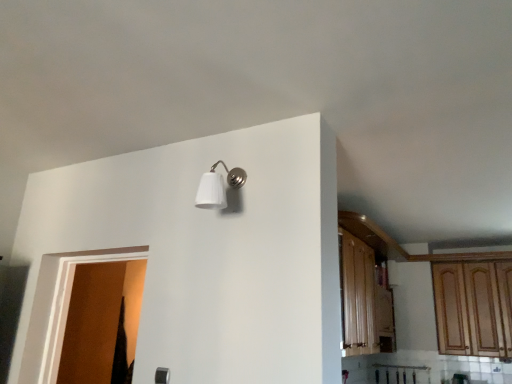
Question: From the image's perspective, is brown matte door at left below wooden cabinet at right?

Choices:
 (A) no
 (B) yes

Answer: (A)

Question: Is brown matte door at left positioned beyond the bounds of wooden cabinet at right?

Choices:
 (A) no
 (B) yes

Answer: (B)

Question: Considering the relative sizes of brown matte door at left and wooden cabinet at right in the image provided, is brown matte door at left thinner than wooden cabinet at right?

Choices:
 (A) yes
 (B) no

Answer: (B)

Question: From the image's perspective, is brown matte door at left located above wooden cabinet at right?

Choices:
 (A) yes
 (B) no

Answer: (A)

Question: From a real-world perspective, is brown matte door at left physically below wooden cabinet at right?

Choices:
 (A) no
 (B) yes

Answer: (B)

Question: Is brown matte door at left at the left side of wooden cabinet at right?

Choices:
 (A) yes
 (B) no

Answer: (A)

Question: Does wooden cabinet at right turn towards white matte wall sconce at upper center?

Choices:
 (A) no
 (B) yes

Answer: (B)

Question: Is wooden cabinet at right positioned in front of white matte wall sconce at upper center?

Choices:
 (A) yes
 (B) no

Answer: (B)

Question: Considering the relative positions of wooden cabinet at right and white matte wall sconce at upper center in the image provided, is wooden cabinet at right to the right of white matte wall sconce at upper center from the viewer's perspective?

Choices:
 (A) no
 (B) yes

Answer: (B)

Question: Considering the relative sizes of wooden cabinet at right and white matte wall sconce at upper center in the image provided, is wooden cabinet at right smaller than white matte wall sconce at upper center?

Choices:
 (A) yes
 (B) no

Answer: (B)

Question: Can you confirm if wooden cabinet at right is positioned to the left of white matte wall sconce at upper center?

Choices:
 (A) no
 (B) yes

Answer: (A)

Question: Is wooden cabinet at right looking in the opposite direction of white matte wall sconce at upper center?

Choices:
 (A) yes
 (B) no

Answer: (B)

Question: From the image's perspective, is wooden cabinet at right above brown matte door at left?

Choices:
 (A) no
 (B) yes

Answer: (A)